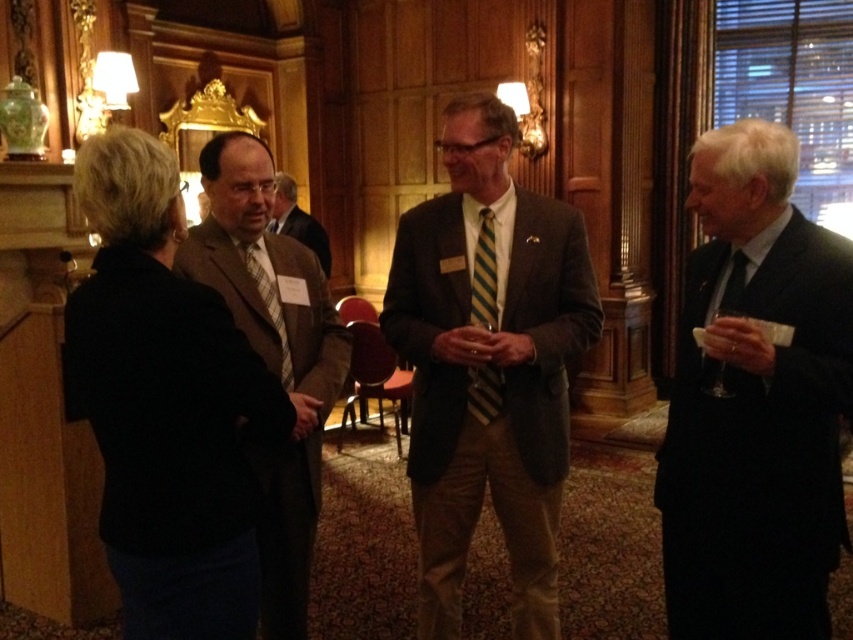
Question: Estimate the real-world distances between objects in this image. Which object is closer to the matte brown suit at center?

Choices:
 (A) dark suit at right
 (B) plaid fabric tie at center
 (C) brown textured suit at center

Answer: (C)

Question: Does dark suit at right appear on the left side of matte brown suit at center?

Choices:
 (A) no
 (B) yes

Answer: (A)

Question: Which point is farther to the camera?

Choices:
 (A) (281, 177)
 (B) (294, 579)
 (C) (741, 292)
 (D) (279, 307)

Answer: (A)

Question: Considering the real-world distances, which object is farthest from the matte green striped tie at right?

Choices:
 (A) dark suit at right
 (B) matte brown suit at center
 (C) plaid fabric tie at center

Answer: (B)

Question: Does matte brown suit at center lie behind plaid fabric tie at center?

Choices:
 (A) no
 (B) yes

Answer: (B)

Question: Is the position of brown textured suit at center more distant than that of matte green striped tie at right?

Choices:
 (A) yes
 (B) no

Answer: (A)